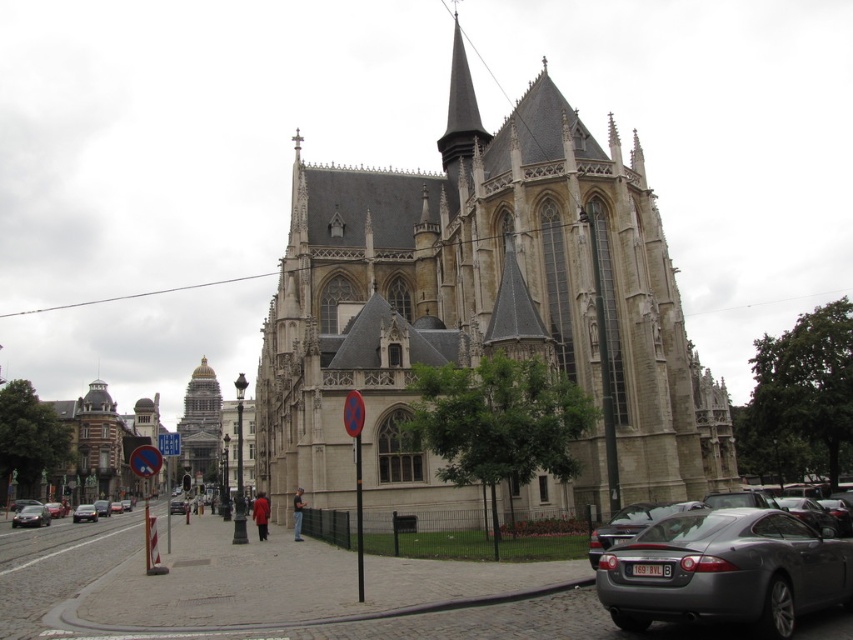
Question: Can you confirm if metallic gray car at lower right is bigger than gold polished tower at center?

Choices:
 (A) yes
 (B) no

Answer: (B)

Question: Which of the following is the closest to the observer?

Choices:
 (A) (578, 220)
 (B) (99, 500)
 (C) (41, 512)
 (D) (97, 518)

Answer: (A)

Question: Does metallic silver car at lower right appear under silver metallic sedan at lower left?

Choices:
 (A) no
 (B) yes

Answer: (A)

Question: Is stone gothic church at center positioned at the back of gold polished tower at center?

Choices:
 (A) no
 (B) yes

Answer: (A)

Question: Based on their relative distances, which object is nearer to the metallic silver car at lower right?

Choices:
 (A) metallic gray car at lower right
 (B) brown stone building at left

Answer: (A)

Question: Which of the following is the closest to the observer?

Choices:
 (A) shiny black sedan at lower left
 (B) metallic silver car at lower right
 (C) metallic gray car at lower right

Answer: (C)